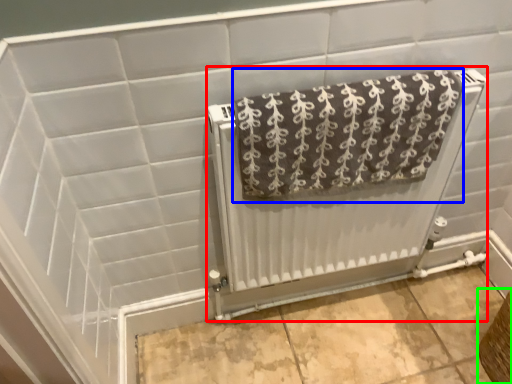
Question: Considering the real-world distances, which object is closest to radiator (highlighted by a red box)? towel (highlighted by a blue box) or basket (highlighted by a green box).

Choices:
 (A) towel
 (B) basket

Answer: (A)